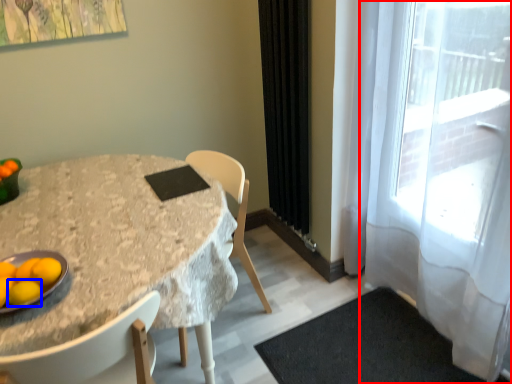
Question: Which object is further to the camera taking this photo, curtain (highlighted by a red box) or lemon (highlighted by a blue box)?

Choices:
 (A) curtain
 (B) lemon

Answer: (B)